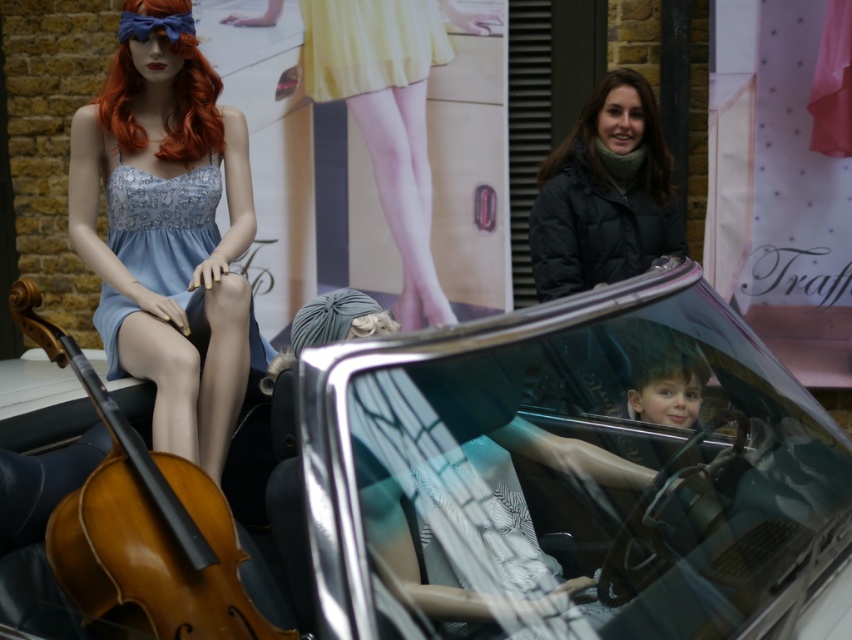
You are designing a new display for a fashion boutique and need to ensure that the shiny silver car at center and the matte blue dress at left will fit on a shelf that is 1.2 meters wide. Based on their sizes, will both items fit together on the shelf?

The shiny silver car at center is wider than the matte blue dress at left. Since the shelf is 1.2 meters wide, we need to know the exact widths of both items to determine if they fit together. However, the provided information only states that the car is wider than the dress, but without specific measurements, we cannot confirm if their combined width exceeds 1.2 meters.

You are a customer looking at the storefront window display. You see the shiny silver car at center and the matte blue dress at left. Which object is positioned lower in the display?

The shiny silver car at center is positioned lower than the matte blue dress at left in the display.

Consider the image. You are a tailor measuring fabrics for alterations. You have a yellow satin skirt at upper center and a gray fabric wig at center. Which item requires more horizontal space when laid flat?

The yellow satin skirt at upper center requires more horizontal space when laid flat because its width surpasses that of the gray fabric wig at center.